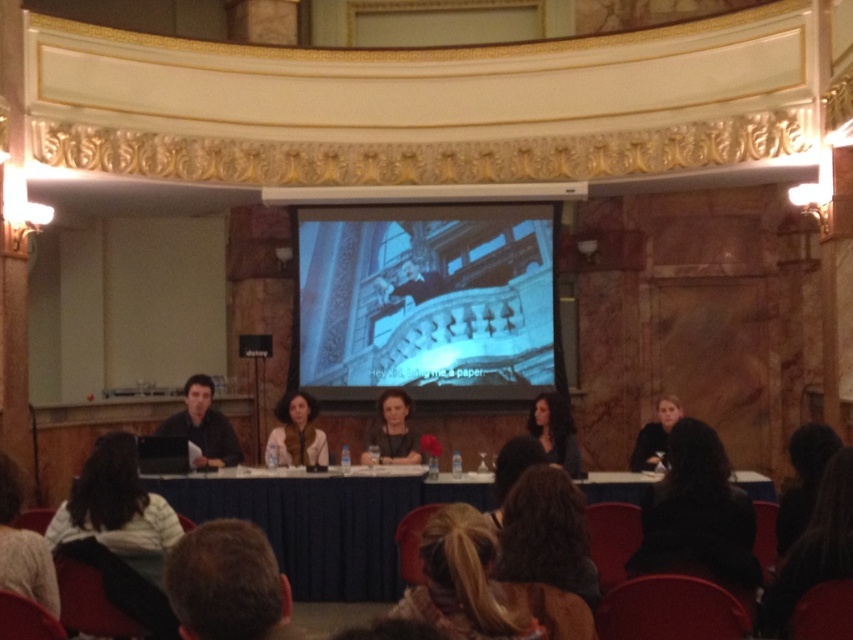
You are a photographer at the event and need to capture a clear photo of the blonde hair at lower center without the brown hair at lower left blocking it. What adjustment should you make to your camera position?

Move your camera position forward to get closer to the blonde hair at lower center so that it is no longer blocked by the brown hair at lower left.